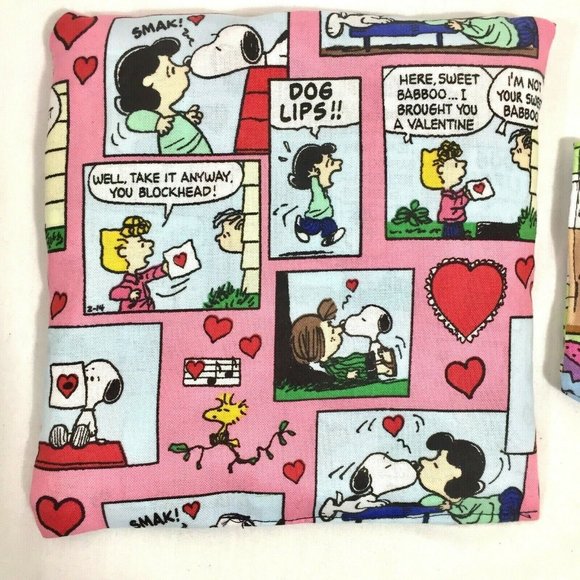
The width and height of the screenshot is (580, 580). What are the coordinates of `music sheet` in the screenshot? It's located at (224, 367).